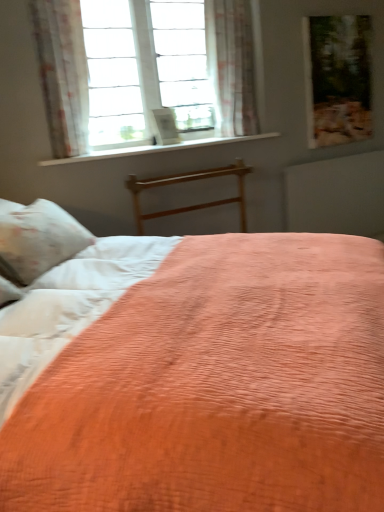
Question: Considering the relative positions of wooden picture frame at upper right and matte wood radiator at upper right in the image provided, is wooden picture frame at upper right to the left or to the right of matte wood radiator at upper right?

Choices:
 (A) right
 (B) left

Answer: (B)

Question: In the image, is wooden picture frame at upper right positioned in front of or behind matte wood radiator at upper right?

Choices:
 (A) front
 (B) behind

Answer: (A)

Question: Which of these objects is positioned farthest from the sheer floral fabric at upper center, placed as the 1th curtain when sorted from back to front?

Choices:
 (A) white smooth window sill at upper center
 (B) floral sheer curtain at upper left, which is counted as the second curtain, starting from the back
 (C) coral quilted bed at center
 (D) wooden picture frame at upper right
 (E) wooden bed frame at center

Answer: (B)

Question: Estimate the real-world distances between objects in this image. Which object is farther from the wooden bed frame at center?

Choices:
 (A) floral sheer curtain at upper left, which is counted as the second curtain, starting from the back
 (B) sheer floral fabric at upper center, arranged as the 1th curtain when viewed from the right
 (C) white smooth window sill at upper center
 (D) wooden picture frame at upper right
 (E) matte wood radiator at upper right

Answer: (D)